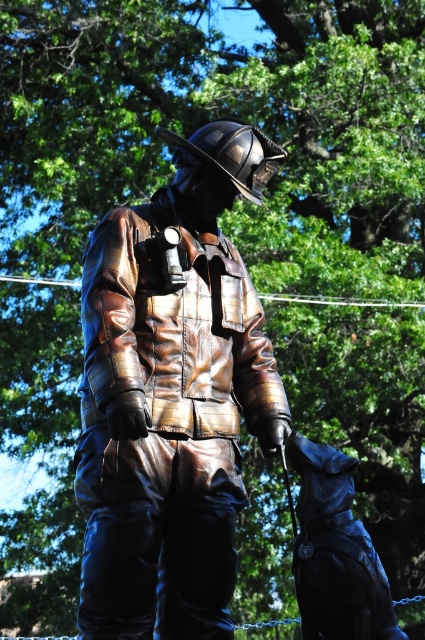
Question: Which of the following is the closest to the observer?

Choices:
 (A) shiny black dog at lower right
 (B) shiny bronze firefighter at center

Answer: (A)

Question: Does shiny bronze firefighter at center appear on the left side of shiny black dog at lower right?

Choices:
 (A) yes
 (B) no

Answer: (A)

Question: Does shiny bronze firefighter at center have a larger size compared to shiny black dog at lower right?

Choices:
 (A) no
 (B) yes

Answer: (B)

Question: In this image, where is shiny bronze firefighter at center located relative to shiny black dog at lower right?

Choices:
 (A) above
 (B) below

Answer: (A)

Question: Which point is closer to the camera?

Choices:
 (A) (187, 541)
 (B) (294, 554)

Answer: (B)